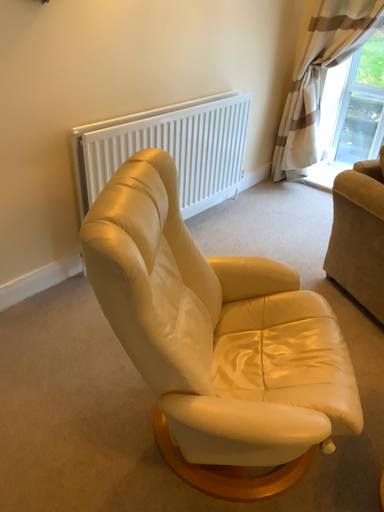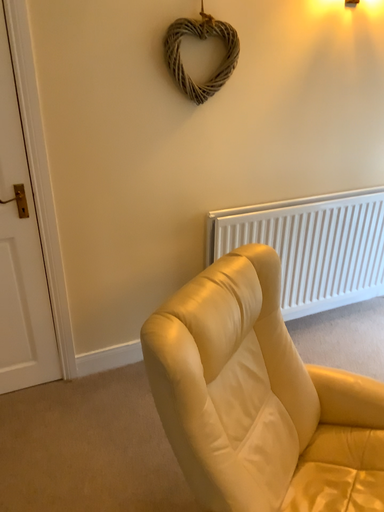
Question: Which way did the camera rotate in the video?

Choices:
 (A) rotated upward
 (B) rotated downward

Answer: (A)